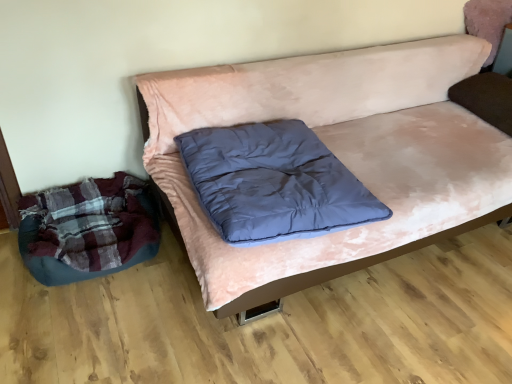
Question: Could you tell me if dark blue down at center is facing plush dark blue bean bag at lower left?

Choices:
 (A) no
 (B) yes

Answer: (A)

Question: Is dark blue down at center in contact with plush dark blue bean bag at lower left?

Choices:
 (A) yes
 (B) no

Answer: (B)

Question: From a real-world perspective, is dark blue down at center physically above plush dark blue bean bag at lower left?

Choices:
 (A) yes
 (B) no

Answer: (A)

Question: From the image's perspective, is dark blue down at center located beneath plush dark blue bean bag at lower left?

Choices:
 (A) no
 (B) yes

Answer: (A)

Question: From a real-world perspective, is dark blue down at center under plush dark blue bean bag at lower left?

Choices:
 (A) no
 (B) yes

Answer: (A)

Question: Is point (279, 286) positioned closer to the camera than point (91, 220)?

Choices:
 (A) farther
 (B) closer

Answer: (B)

Question: Is pink velvety couch at center taller or shorter than plush dark blue bean bag at lower left?

Choices:
 (A) short
 (B) tall

Answer: (B)

Question: Is pink velvety couch at center spatially inside plush dark blue bean bag at lower left, or outside of it?

Choices:
 (A) outside
 (B) inside

Answer: (A)

Question: In terms of size, does pink velvety couch at center appear bigger or smaller than plush dark blue bean bag at lower left?

Choices:
 (A) small
 (B) big

Answer: (B)

Question: Considering their positions, is pink velvety couch at center located in front of or behind dark blue down at center?

Choices:
 (A) behind
 (B) front

Answer: (B)

Question: From a real-world perspective, is pink velvety couch at center physically located above or below dark blue down at center?

Choices:
 (A) below
 (B) above

Answer: (A)

Question: Would you say pink velvety couch at center is inside or outside dark blue down at center?

Choices:
 (A) inside
 (B) outside

Answer: (B)

Question: In terms of width, does pink velvety couch at center look wider or thinner when compared to dark blue down at center?

Choices:
 (A) thin
 (B) wide

Answer: (B)

Question: Based on their positions, is dark blue down at center located to the left or right of pink velvety couch at center?

Choices:
 (A) right
 (B) left

Answer: (B)

Question: Is dark blue down at center in front of or behind pink velvety couch at center in the image?

Choices:
 (A) front
 (B) behind

Answer: (B)